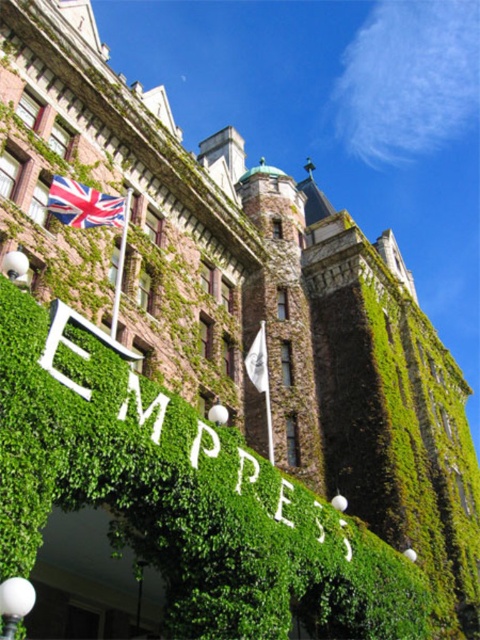
Question: Does union jack fabric flag at upper left appear under white fabric flag at center?

Choices:
 (A) yes
 (B) no

Answer: (B)

Question: Does union jack fabric flag at upper left appear on the left side of white fabric flag at center?

Choices:
 (A) yes
 (B) no

Answer: (A)

Question: Which point is closer to the camera?

Choices:
 (A) union jack fabric flag at upper left
 (B) white fabric flag at center

Answer: (A)

Question: Observing the image, what is the correct spatial positioning of union jack fabric flag at upper left in reference to white fabric flag at center?

Choices:
 (A) above
 (B) below

Answer: (A)

Question: Which object appears farthest from the camera in this image?

Choices:
 (A) white fabric flag at center
 (B) union jack fabric flag at upper left

Answer: (A)